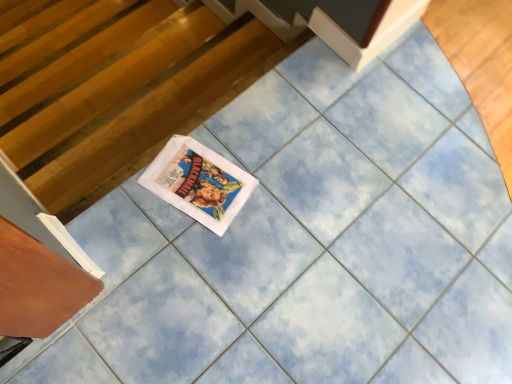
Where is `vacant area that is situated to the right of wooden drawer at lower left`? Image resolution: width=512 pixels, height=384 pixels. vacant area that is situated to the right of wooden drawer at lower left is located at coordinates (133, 329).